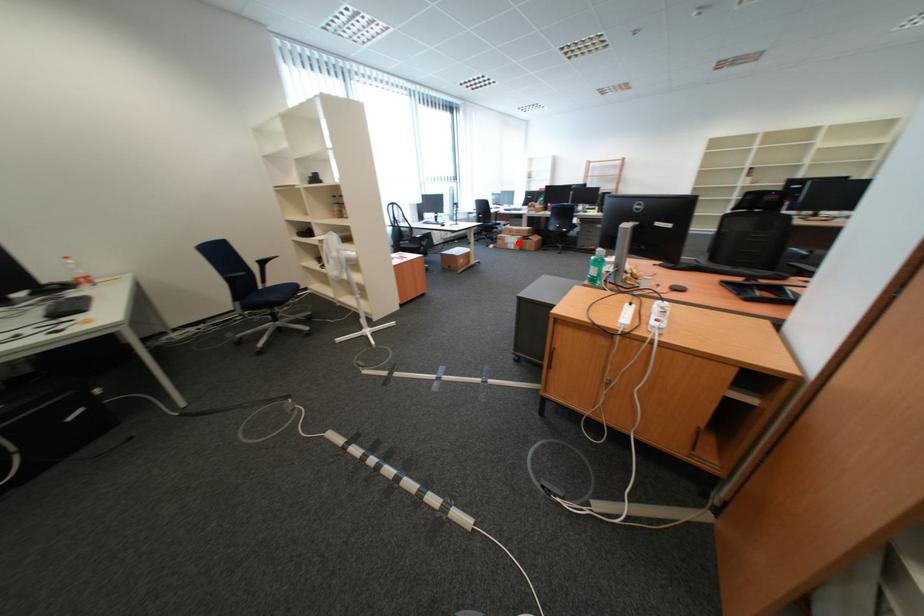
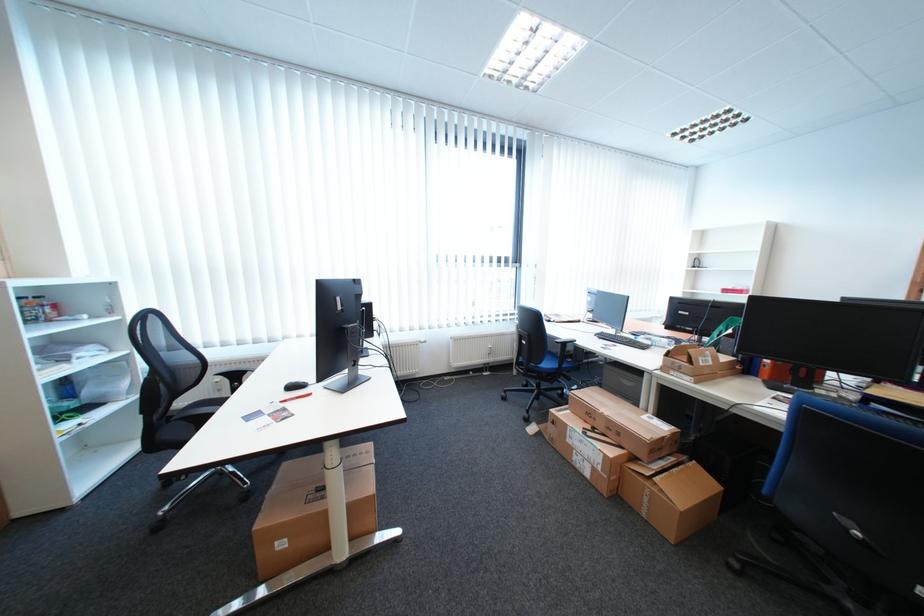
In the second image, find the point that corresponds to the highlighted location in the first image.

(580, 442)